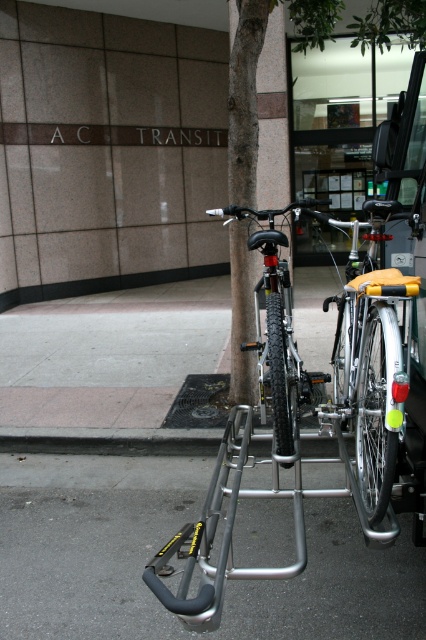
Question: In this image, where is matte black bicycle at center located relative to shiny black bike at center?

Choices:
 (A) right
 (B) left

Answer: (A)

Question: Among these objects, which one is nearest to the camera?

Choices:
 (A) matte black bicycle at center
 (B) metallic gray pavement at lower center

Answer: (A)

Question: Estimate the real-world distances between objects in this image. Which object is farther from the matte black bicycle at center?

Choices:
 (A) metallic gray pavement at lower center
 (B) shiny black bike at center

Answer: (A)

Question: Does metallic gray pavement at lower center appear over matte black bicycle at center?

Choices:
 (A) yes
 (B) no

Answer: (B)

Question: Can you confirm if matte black bicycle at center is bigger than shiny black bike at center?

Choices:
 (A) yes
 (B) no

Answer: (A)

Question: Which point is farther to the camera?

Choices:
 (A) matte black bicycle at center
 (B) metallic gray pavement at lower center
 (C) shiny black bike at center

Answer: (C)